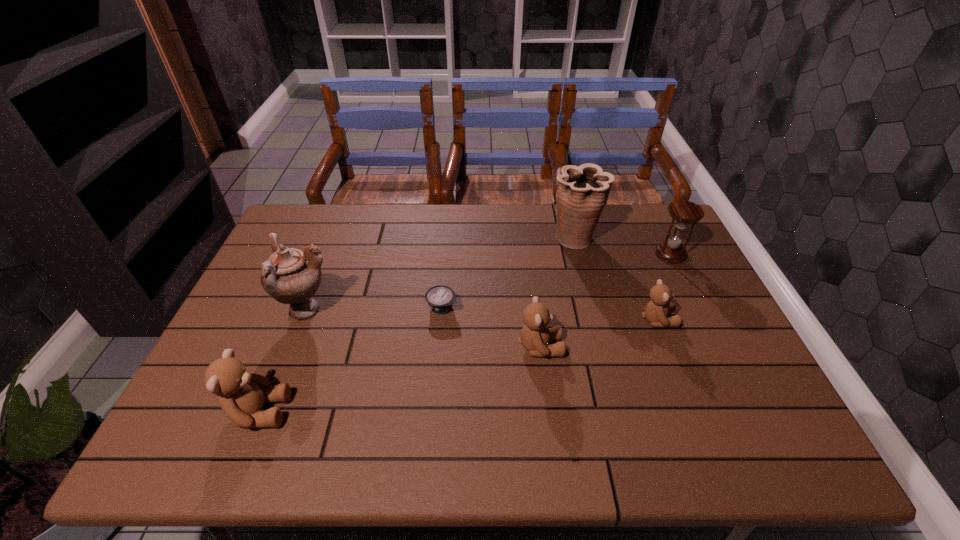
The image size is (960, 540). I want to click on the nearest teddy bear, so click(242, 395).

Identify the location of the leftmost teddy bear. This screenshot has height=540, width=960. (242, 395).

Identify the location of the second teddy bear from left to right. (535, 335).

Where is `the second tallest teddy bear`? the second tallest teddy bear is located at coordinates (535, 335).

Locate an element on the screen. The height and width of the screenshot is (540, 960). the sixth tallest object is located at coordinates (655, 311).

This screenshot has height=540, width=960. Find the location of `the rightmost teddy bear`. the rightmost teddy bear is located at coordinates (655, 311).

This screenshot has width=960, height=540. Identify the location of the third object from right to left. (583, 191).

Find the location of a particular element. This screenshot has height=540, width=960. the right urn is located at coordinates (583, 191).

Locate an element on the screen. The height and width of the screenshot is (540, 960). the left urn is located at coordinates (290, 276).

The image size is (960, 540). In order to click on the rightmost object in this screenshot , I will do `click(683, 212)`.